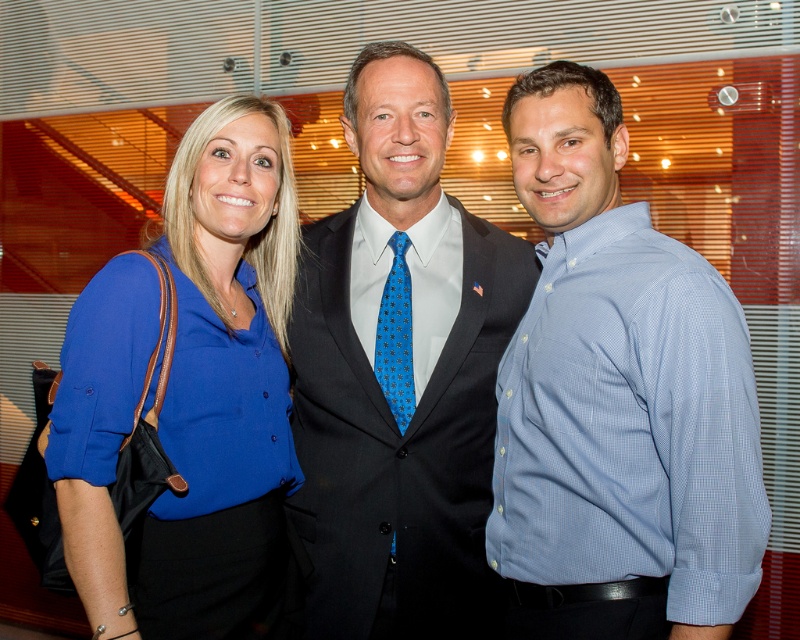
How far apart are matte black suit at center and blue dotted tie at center?

matte black suit at center and blue dotted tie at center are 5.76 inches apart.

Is matte black suit at center further to camera compared to blue dotted tie at center?

No.

Is point (358, 320) closer to camera compared to point (408, 236)?

Yes, point (358, 320) is in front of point (408, 236).

Where is `matte black suit at center`? matte black suit at center is located at coordinates (400, 372).

Which is below, blue checkered shirt at right or matte black suit at center?

Positioned lower is matte black suit at center.

Can you confirm if blue checkered shirt at right is thinner than matte black suit at center?

Correct, blue checkered shirt at right's width is less than matte black suit at center's.

Who is more forward, [648,588] or [436,180]?

Point [648,588]

Where is `blue checkered shirt at right`? blue checkered shirt at right is located at coordinates (617, 400).

Can you confirm if matte black suit at center is positioned below blue fabric shirt at center?

Incorrect, matte black suit at center is not positioned below blue fabric shirt at center.

Does matte black suit at center have a lesser height compared to blue fabric shirt at center?

Incorrect, matte black suit at center's height does not fall short of blue fabric shirt at center's.

This screenshot has height=640, width=800. What do you see at coordinates (400, 372) in the screenshot? I see `matte black suit at center` at bounding box center [400, 372].

You are a GUI agent. You are given a task and a screenshot of the screen. Output one action in this format:
    pyautogui.click(x=<x>, y=<y>)
    Task: Click on the matte black suit at center
    This screenshot has width=800, height=640.
    Given the screenshot: What is the action you would take?
    pyautogui.click(x=400, y=372)